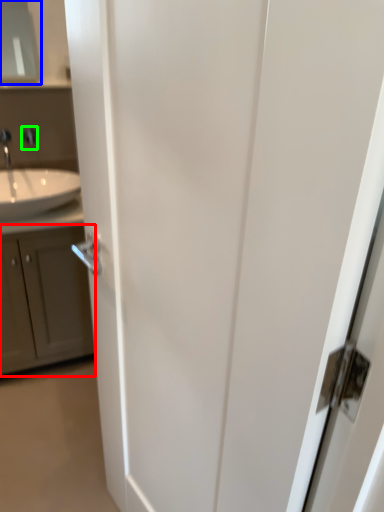
Question: Based on their relative distances, which object is farther from cabinetry (highlighted by a red box)? Choose from medicine cabinet (highlighted by a blue box) and faucet (highlighted by a green box).

Choices:
 (A) medicine cabinet
 (B) faucet

Answer: (A)